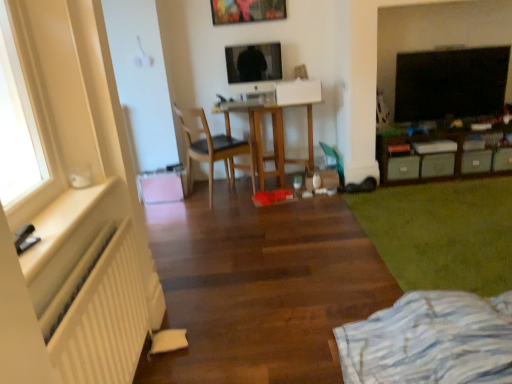
The height and width of the screenshot is (384, 512). I want to click on free space above green matte drawer at right, which appears as the 2th drawer when viewed from the right (from a real-world perspective), so click(x=480, y=147).